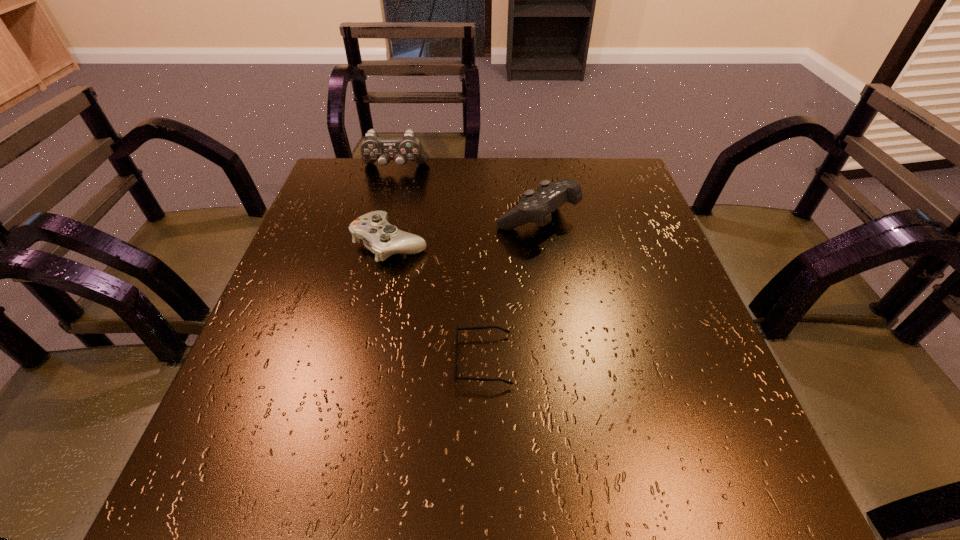
The height and width of the screenshot is (540, 960). What are the coordinates of `the farthest control` in the screenshot? It's located at (373, 148).

Find the location of a particular element. the tallest object is located at coordinates (373, 148).

What are the coordinates of `the second tallest object` in the screenshot? It's located at (537, 207).

The image size is (960, 540). What are the coordinates of `the rightmost control` in the screenshot? It's located at (537, 207).

You are a GUI agent. You are given a task and a screenshot of the screen. Output one action in this format:
    pyautogui.click(x=<x>, y=<y>)
    Task: Click on the third tallest object
    
    Given the screenshot: What is the action you would take?
    pyautogui.click(x=378, y=235)

Identify the location of the nearest object. (483, 327).

Where is `sunglasses`? The height and width of the screenshot is (540, 960). sunglasses is located at coordinates (483, 327).

The height and width of the screenshot is (540, 960). Identify the location of vacant space located 0.140m on the surface of the tallest object with buttons. (386, 207).

What are the coordinates of `vacant space located 0.250m on the front of the third shortest object` in the screenshot? It's located at [555, 332].

Locate an element on the screen. The image size is (960, 540). vacant space located on the front of the second shortest object is located at coordinates click(365, 357).